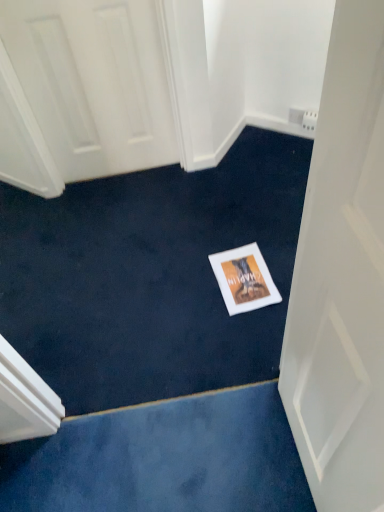
Question: In terms of size, does white matte door at center appear bigger or smaller than white matte postcard at center?

Choices:
 (A) small
 (B) big

Answer: (B)

Question: From the image's perspective, is white matte door at center positioned above or below white matte postcard at center?

Choices:
 (A) below
 (B) above

Answer: (A)

Question: Is white matte door at center taller or shorter than white matte postcard at center?

Choices:
 (A) short
 (B) tall

Answer: (B)

Question: In terms of height, does white matte postcard at center look taller or shorter compared to white matte door at center?

Choices:
 (A) tall
 (B) short

Answer: (B)

Question: In the image, is white matte postcard at center on the left side or the right side of white matte door at center?

Choices:
 (A) right
 (B) left

Answer: (B)

Question: From the image's perspective, is white matte postcard at center above or below white matte door at center?

Choices:
 (A) above
 (B) below

Answer: (A)

Question: Is white matte postcard at center inside the boundaries of white matte door at center, or outside?

Choices:
 (A) inside
 (B) outside

Answer: (B)